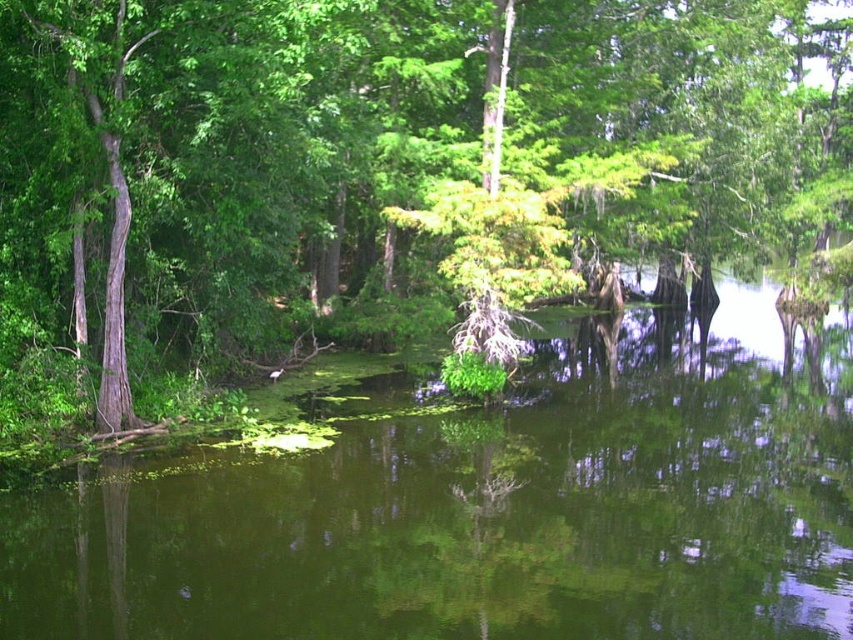
Does green leafy tree at center have a lesser height compared to green algae at center?

No, green leafy tree at center is not shorter than green algae at center.

Is point (299, 312) positioned before point (595, 429)?

That is False.

You are a GUI agent. You are given a task and a screenshot of the screen. Output one action in this format:
    pyautogui.click(x=<x>, y=<y>)
    Task: Click on the green leafy tree at center
    The width and height of the screenshot is (853, 640).
    Given the screenshot: What is the action you would take?
    pyautogui.click(x=380, y=163)